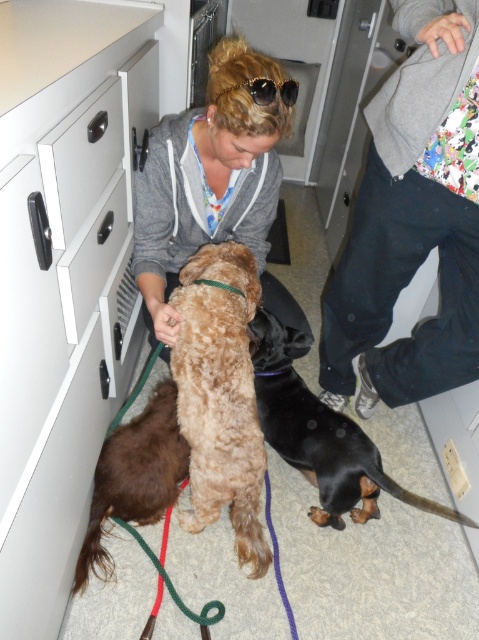
Question: Is brown fuzzy dog at lower left below black plastic sunglasses at upper center?

Choices:
 (A) yes
 (B) no

Answer: (A)

Question: Is white matte drawer at center left to the right of white plastic drawer at left from the viewer's perspective?

Choices:
 (A) yes
 (B) no

Answer: (A)

Question: Can you confirm if brown fuzzy dog at lower left is positioned to the left of white plastic drawer at left?

Choices:
 (A) no
 (B) yes

Answer: (A)

Question: Based on their relative distances, which object is nearer to the white plastic drawer at left?

Choices:
 (A) brown fuzzy dog at lower left
 (B) fuzzy brown dog at center
 (C) gray fleece sweater at upper center

Answer: (B)

Question: Among these objects, which one is farthest from the camera?

Choices:
 (A) black plastic sunglasses at upper center
 (B) white matte drawer at center left
 (C) white plastic file cabinet at left
 (D) gray fleece sweater at upper center

Answer: (A)

Question: Among these objects, which one is farthest from the camera?

Choices:
 (A) brown fuzzy dog at lower left
 (B) black smooth dachshund at lower center
 (C) fuzzy brown dog at center
 (D) matte gray hoodie at center

Answer: (A)